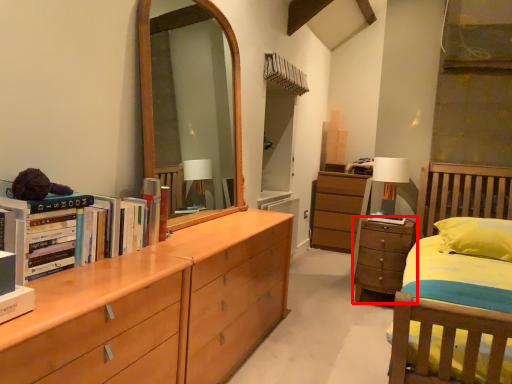
Question: From the image's perspective, considering the relative positions of chest of drawers (annotated by the red box) and table lamp in the image provided, where is chest of drawers (annotated by the red box) located with respect to the staircase?

Choices:
 (A) above
 (B) below

Answer: (B)